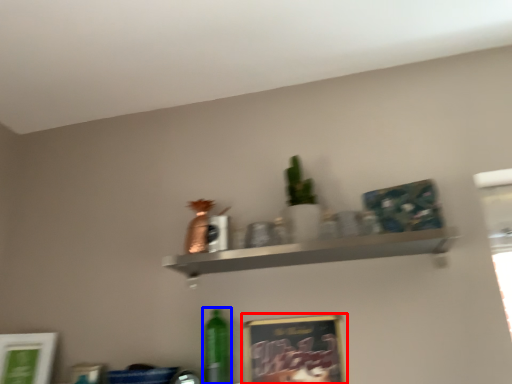
Question: Which point is closer to the camera, picture frame (highlighted by a red box) or bottle (highlighted by a blue box)?

Choices:
 (A) picture frame
 (B) bottle

Answer: (A)